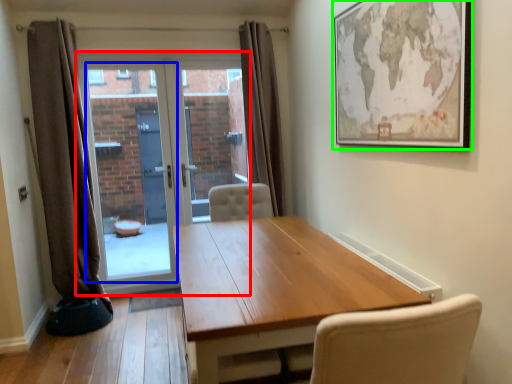
Question: Which object is the closest to the door (highlighted by a red box)? Choose among these: window screen (highlighted by a blue box) or picture frame (highlighted by a green box).

Choices:
 (A) window screen
 (B) picture frame

Answer: (A)